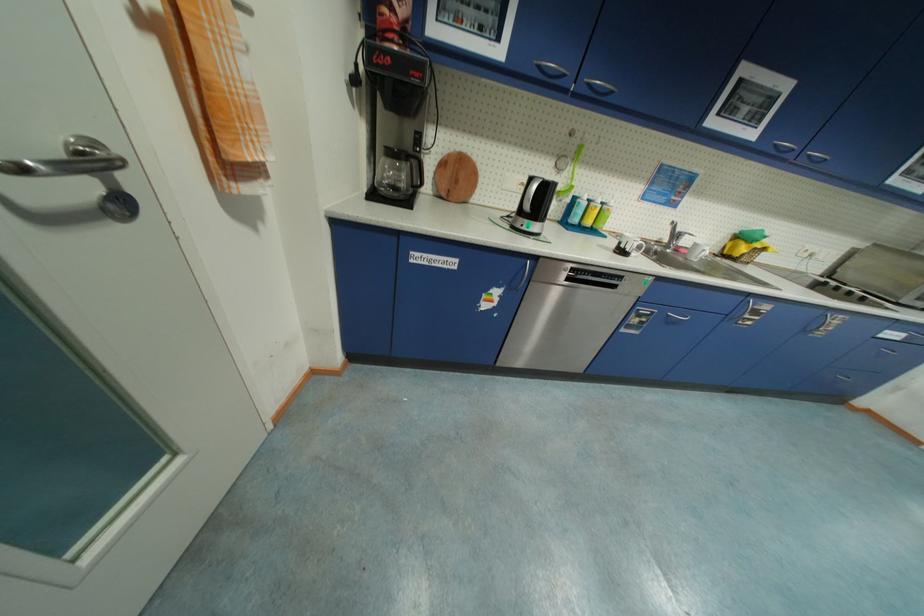
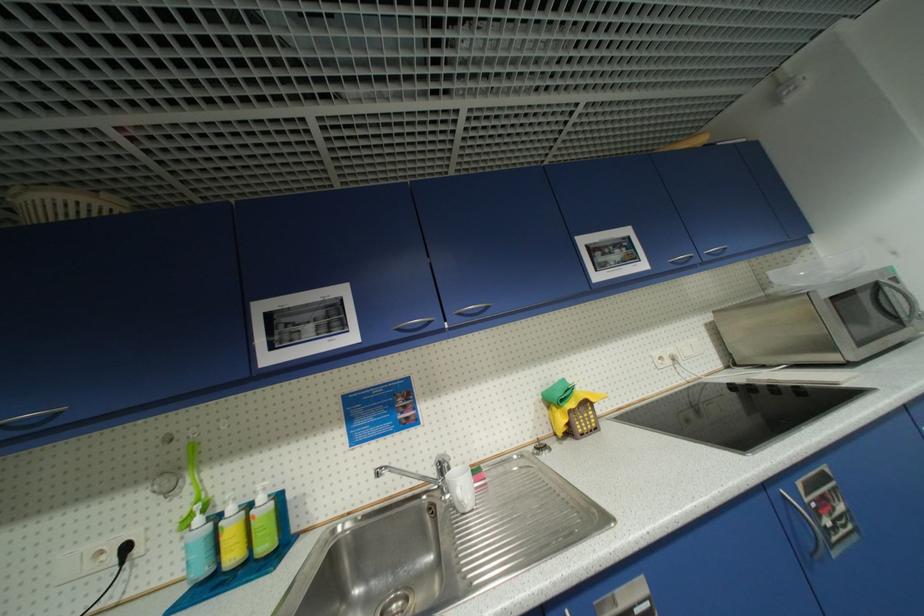
The point at (674, 252) is marked in the first image. Where is the corresponding point in the second image?

(454, 496)